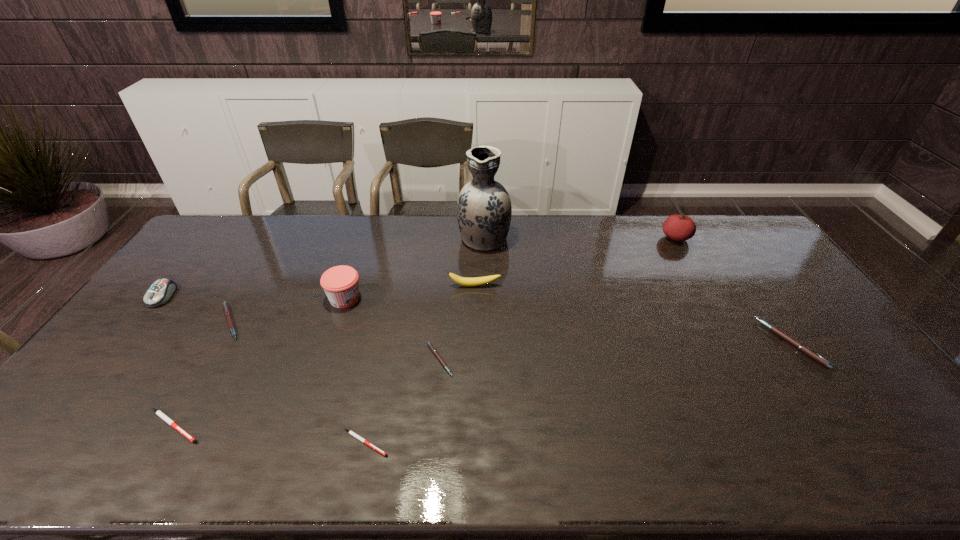
This screenshot has width=960, height=540. Identify the location of vacant area that lies between the second pen from right to left and the rightmost object. (615, 352).

In order to click on vacant region between the right white pen and the jam in this screenshot , I will do `click(355, 370)`.

Find the location of a particular element. The height and width of the screenshot is (540, 960). empty space between the jam and the tallest object is located at coordinates (415, 268).

At what (x,y) coordinates should I click in order to perform the action: click on vacant point located between the jam and the bigger white pen. Please return your answer as a coordinate pair (x, y). The image size is (960, 540). Looking at the image, I should click on (259, 362).

Locate an element on the screen. vacant space that is in between the blue vase and the right white pen is located at coordinates [424, 340].

Locate an element on the screen. vacant area that lies between the left white pen and the red tomato is located at coordinates (425, 332).

At what (x,y) coordinates should I click in order to perform the action: click on vacant point located between the left white pen and the yellow banana. Please return your answer as a coordinate pair (x, y). This screenshot has height=540, width=960. Looking at the image, I should click on (324, 356).

The width and height of the screenshot is (960, 540). I want to click on vacant space in between the jam and the second pink pen from right to left, so click(x=392, y=329).

You are a GUI agent. You are given a task and a screenshot of the screen. Output one action in this format:
    pyautogui.click(x=<x>, y=<y>)
    Task: Click on the vacant point located between the rightmost pen and the second tallest pen
    
    Given the screenshot: What is the action you would take?
    pyautogui.click(x=511, y=333)

Select which object is the fifth closest to the sixth object from right to left. Please provide its 2D coordinates. Your answer should be formatted as a tuple, i.e. [(x, y)], where the tuple contains the x and y coordinates of a point satisfying the conditions above.

[(477, 281)]